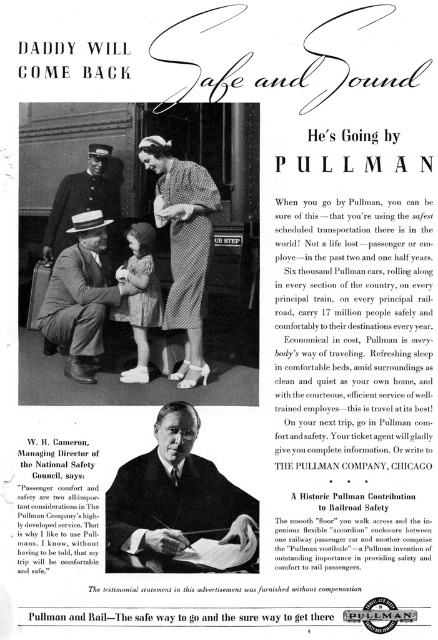
In the vintage Pullman advertisement, there is a point marked at coordinates [183,246]. What object is located at this point?

The point at coordinates [183,246] corresponds to the checkered fabric dress at center.

What is the exact coordinate of the smooth black suit at center in the image?

The smooth black suit at center is located at point (176, 506).

Based on the provided image description, where is the checkered fabric dress at center located in the scene?

The checkered fabric dress at center is located at point (183, 246) in the scene.